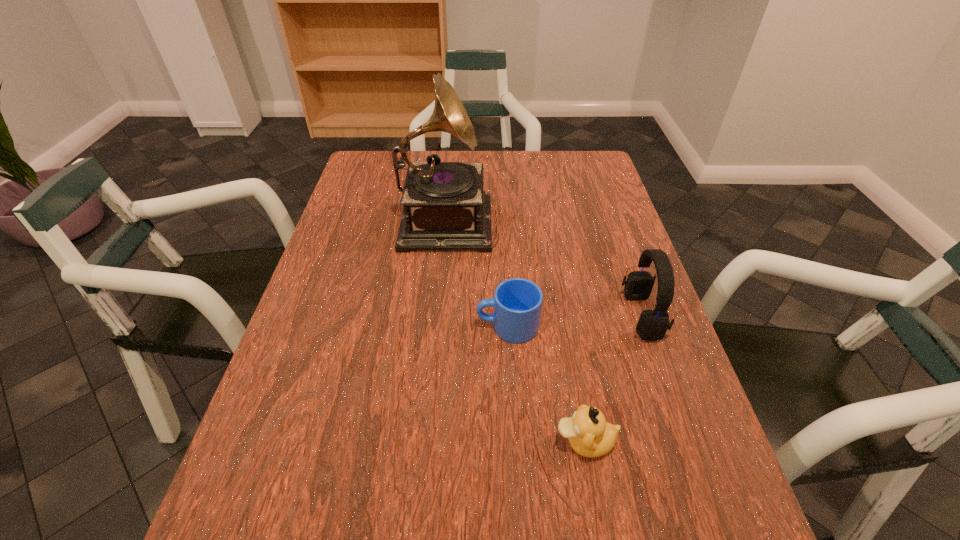
In order to click on free space located 0.250m on the headband of the headset in this screenshot , I will do `click(516, 315)`.

I want to click on vacant space positioned 0.370m on the face of the nearest object, so click(349, 442).

I want to click on vacant space positioned 0.130m on the face of the nearest object, so click(483, 442).

Where is `vacant space situated 0.300m on the face of the nearest object`? The height and width of the screenshot is (540, 960). vacant space situated 0.300m on the face of the nearest object is located at coordinates (388, 442).

Find the location of `vacant space located on the side of the mug with the handle`. vacant space located on the side of the mug with the handle is located at coordinates (432, 326).

The height and width of the screenshot is (540, 960). Identify the location of vacant space situated on the side of the mug with the handle. (419, 326).

You are a GUI agent. You are given a task and a screenshot of the screen. Output one action in this format:
    pyautogui.click(x=<x>, y=<y>)
    Task: Click on the vacant space positioned on the side of the mug with the handle
    The image size is (960, 540).
    Given the screenshot: What is the action you would take?
    pyautogui.click(x=306, y=326)

In order to click on object that is at the far edge in this screenshot , I will do `click(445, 207)`.

Find the location of a particular element. object that is at the right edge is located at coordinates (653, 324).

Where is `vacant area at the far edge of the desktop`? This screenshot has width=960, height=540. vacant area at the far edge of the desktop is located at coordinates (494, 166).